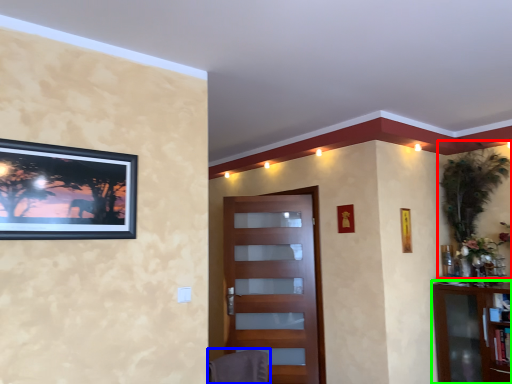
Question: Which is farther away from plant (highlighted by a red box)? swivel chair (highlighted by a blue box) or cabinetry (highlighted by a green box)?

Choices:
 (A) swivel chair
 (B) cabinetry

Answer: (A)